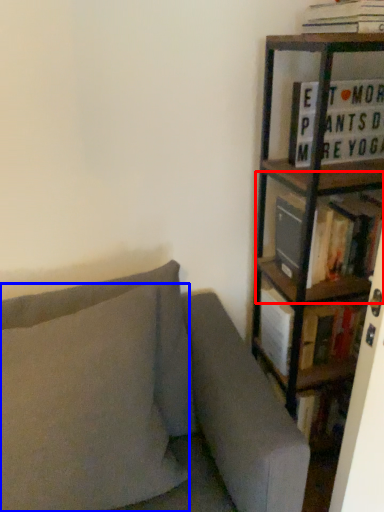
Question: Which of the following is the closest to the observer, shelf (highlighted by a red box) or pillow (highlighted by a blue box)?

Choices:
 (A) shelf
 (B) pillow

Answer: (B)